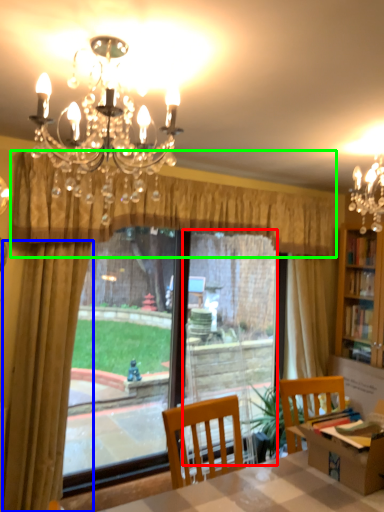
Question: Considering the real-world distances, which object is farthest from screen door (highlighted by a red box)? curtain (highlighted by a blue box) or curtain (highlighted by a green box)?

Choices:
 (A) curtain
 (B) curtain

Answer: (A)